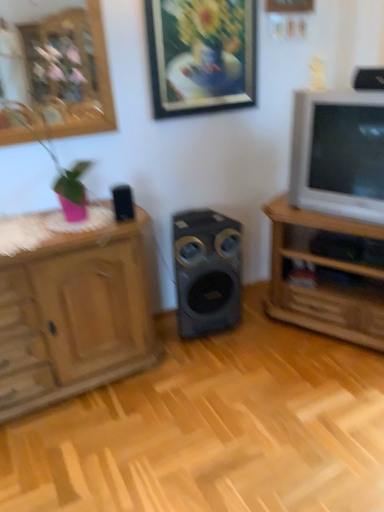
I want to click on free space in front of wooden cabinet at left, so click(96, 446).